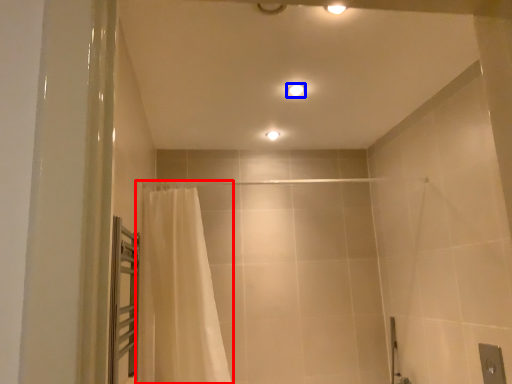
Question: Which point is further to the camera, curtain (highlighted by a red box) or light fixture (highlighted by a blue box)?

Choices:
 (A) curtain
 (B) light fixture

Answer: (B)